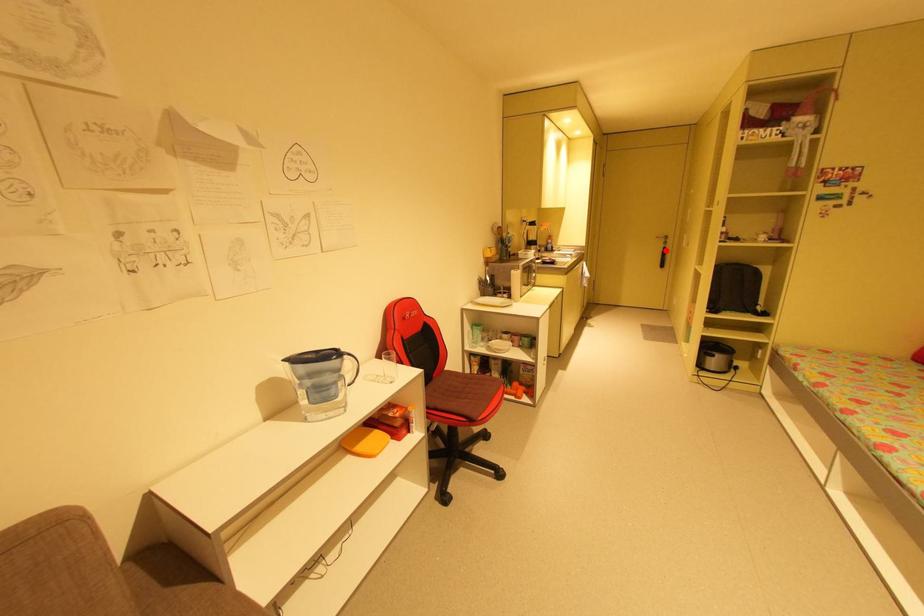
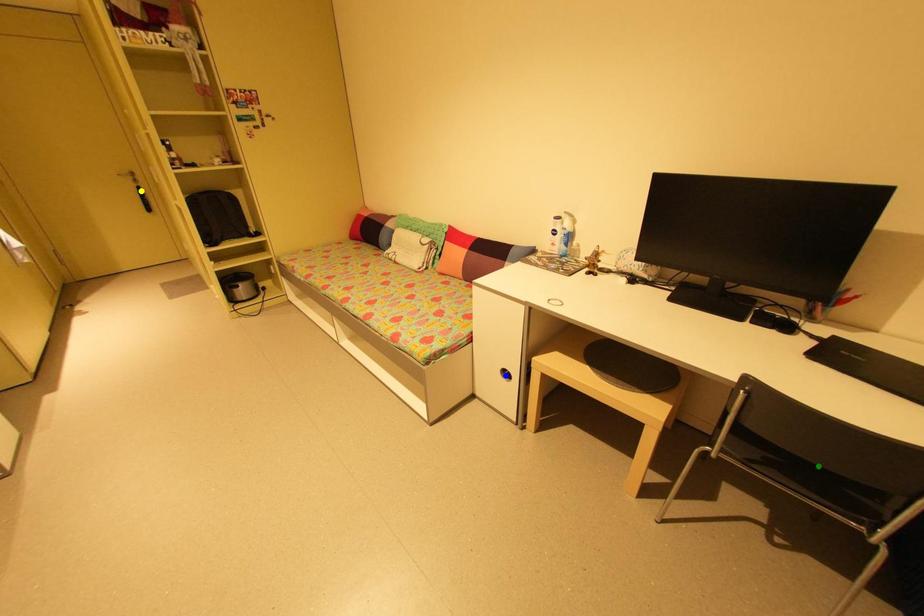
Question: I am providing you with two images of the same scene from different viewpoints. A red point is marked on the first image. You are given multiple points on the second image. Which point in image 2 represents the same 3d spot as the red point in image 1?

Choices:
 (A) blue point
 (B) green point
 (C) yellow point

Answer: (C)